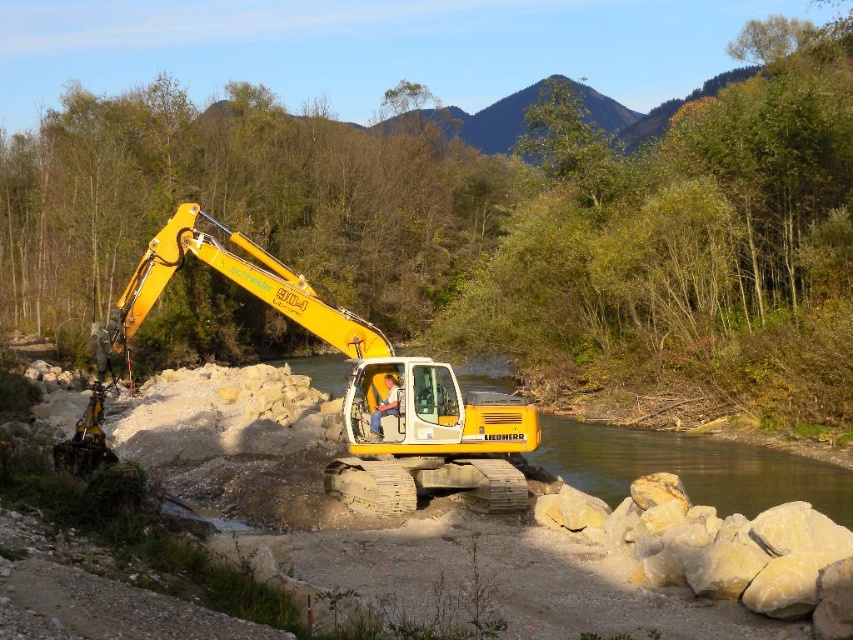
Question: Which point is closer to the camera?

Choices:
 (A) (149, 260)
 (B) (576, 470)

Answer: (A)

Question: Does yellow rubber excavator at center appear on the left side of clear water at center?

Choices:
 (A) yes
 (B) no

Answer: (B)

Question: Can you confirm if yellow rubber excavator at center is positioned to the right of clear water at center?

Choices:
 (A) yes
 (B) no

Answer: (A)

Question: Where is yellow rubber excavator at center located in relation to clear water at center in the image?

Choices:
 (A) below
 (B) above

Answer: (B)